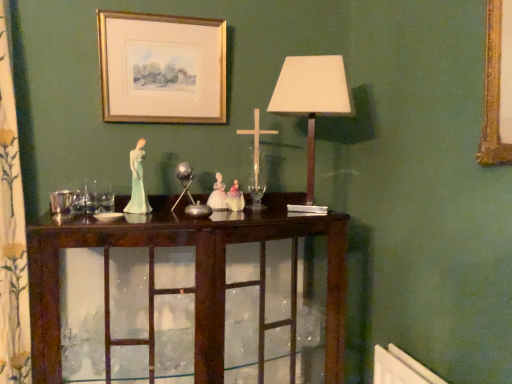
Question: Is dark wood cabinet at center placed right next to floral-patterned fabric at left?

Choices:
 (A) no
 (B) yes

Answer: (A)

Question: Can you confirm if dark wood cabinet at center is smaller than floral-patterned fabric at left?

Choices:
 (A) yes
 (B) no

Answer: (B)

Question: From the image's perspective, is dark wood cabinet at center located beneath floral-patterned fabric at left?

Choices:
 (A) yes
 (B) no

Answer: (A)

Question: Does dark wood cabinet at center appear on the right side of floral-patterned fabric at left?

Choices:
 (A) no
 (B) yes

Answer: (B)

Question: Is dark wood cabinet at center taller than floral-patterned fabric at left?

Choices:
 (A) no
 (B) yes

Answer: (A)

Question: Is floral-patterned fabric at left inside or outside of matte white lampshade at center?

Choices:
 (A) inside
 (B) outside

Answer: (B)

Question: From a real-world perspective, is floral-patterned fabric at left positioned above or below matte white lampshade at center?

Choices:
 (A) below
 (B) above

Answer: (A)

Question: Is floral-patterned fabric at left to the left or to the right of matte white lampshade at center in the image?

Choices:
 (A) right
 (B) left

Answer: (B)

Question: In the image, is floral-patterned fabric at left positioned in front of or behind matte white lampshade at center?

Choices:
 (A) behind
 (B) front

Answer: (B)

Question: Does point (342, 59) appear closer or farther from the camera than point (184, 61)?

Choices:
 (A) closer
 (B) farther

Answer: (B)

Question: Is matte white lampshade at center spatially inside gold/glossy picture frame at upper center, or outside of it?

Choices:
 (A) inside
 (B) outside

Answer: (B)

Question: Considering the positions of matte white lampshade at center and gold/glossy picture frame at upper center in the image, is matte white lampshade at center taller or shorter than gold/glossy picture frame at upper center?

Choices:
 (A) tall
 (B) short

Answer: (A)

Question: Based on their sizes in the image, would you say matte white lampshade at center is bigger or smaller than gold/glossy picture frame at upper center?

Choices:
 (A) small
 (B) big

Answer: (B)

Question: Is porcelain figure at center taller or shorter than dark wood cabinet at center?

Choices:
 (A) short
 (B) tall

Answer: (A)

Question: In the image, is porcelain figure at center positioned in front of or behind dark wood cabinet at center?

Choices:
 (A) front
 (B) behind

Answer: (B)